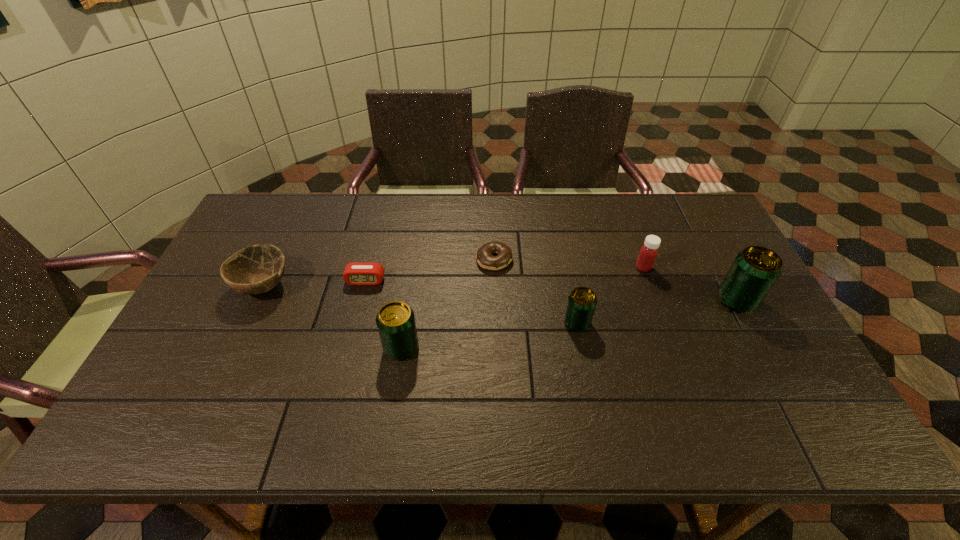
Where is `the sixth shortest object`? This screenshot has height=540, width=960. the sixth shortest object is located at coordinates (395, 320).

Where is `the second shortest beer can`? The width and height of the screenshot is (960, 540). the second shortest beer can is located at coordinates (395, 320).

Image resolution: width=960 pixels, height=540 pixels. Find the location of `the third object from right to left`. the third object from right to left is located at coordinates (582, 301).

Where is `the second beer can from left to right`? Image resolution: width=960 pixels, height=540 pixels. the second beer can from left to right is located at coordinates (582, 301).

The image size is (960, 540). Find the location of `the rightmost beer can`. the rightmost beer can is located at coordinates (755, 270).

Identify the location of the tallest object. (755, 270).

Where is `the leftmost object`? The height and width of the screenshot is (540, 960). the leftmost object is located at coordinates (256, 269).

Locate an element on the screen. The image size is (960, 540). bowl is located at coordinates (256, 269).

I want to click on the fourth object from right to left, so click(x=484, y=257).

Identify the location of doughnut. (484, 257).